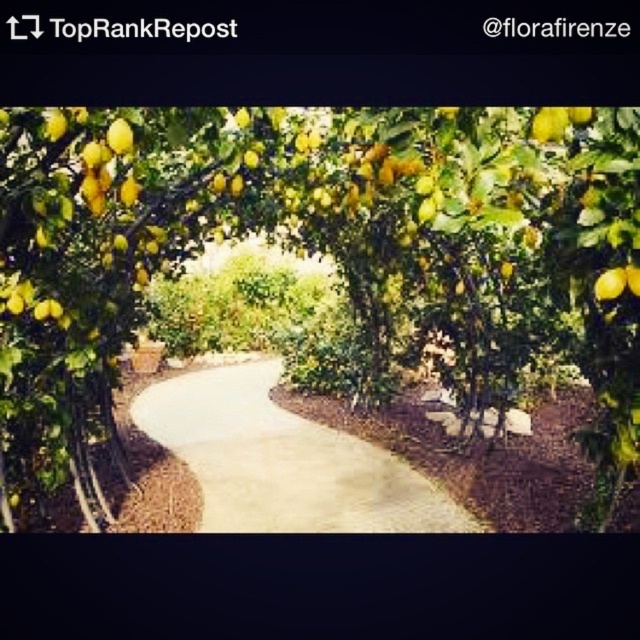
You are a gardener planning to plant a new tree in the lemon grove. You want to ensure there is enough space between the yellow matte lemon tree at center and the smooth concrete path at center. Based on their widths, which one requires more horizontal space to accommodate its width?

The smooth concrete path at center requires more horizontal space because it is wider than the yellow matte lemon tree at center.

You are planning to place a small decorative statue exactly between the yellow matte lemon tree at center and the yellow matte lemon at upper right. Which object will the statue be closer to?

The statue will be closer to the yellow matte lemon at upper right because the yellow matte lemon tree at center is bigger than the yellow matte lemon at upper right, meaning the lemon is smaller and likely positioned farther away.